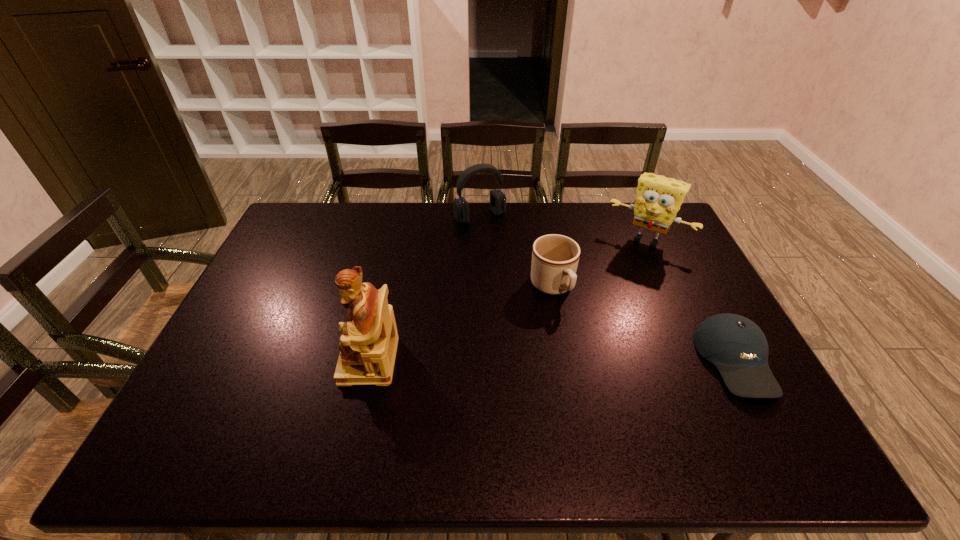
Identify the location of the leftmost object. The width and height of the screenshot is (960, 540). (368, 345).

This screenshot has height=540, width=960. I want to click on the tallest object, so click(x=368, y=345).

Locate an element on the screen. the shortest object is located at coordinates click(x=738, y=348).

Image resolution: width=960 pixels, height=540 pixels. What are the coordinates of `the fourth tallest object` in the screenshot? It's located at (555, 258).

You are a GUI agent. You are given a task and a screenshot of the screen. Output one action in this format:
    pyautogui.click(x=<x>, y=<y>)
    Task: Click on the mug
    
    Given the screenshot: What is the action you would take?
    pyautogui.click(x=555, y=258)

The width and height of the screenshot is (960, 540). I want to click on headset, so click(497, 198).

Locate an element on the screen. sponge is located at coordinates (658, 199).

Find the location of a particular element. blank area located on the front-facing side of the figurine is located at coordinates (253, 360).

Find the location of a particular element. The width and height of the screenshot is (960, 540). vacant space located 0.300m on the front-facing side of the figurine is located at coordinates (227, 360).

This screenshot has width=960, height=540. I want to click on free space located on the front-facing side of the figurine, so click(215, 360).